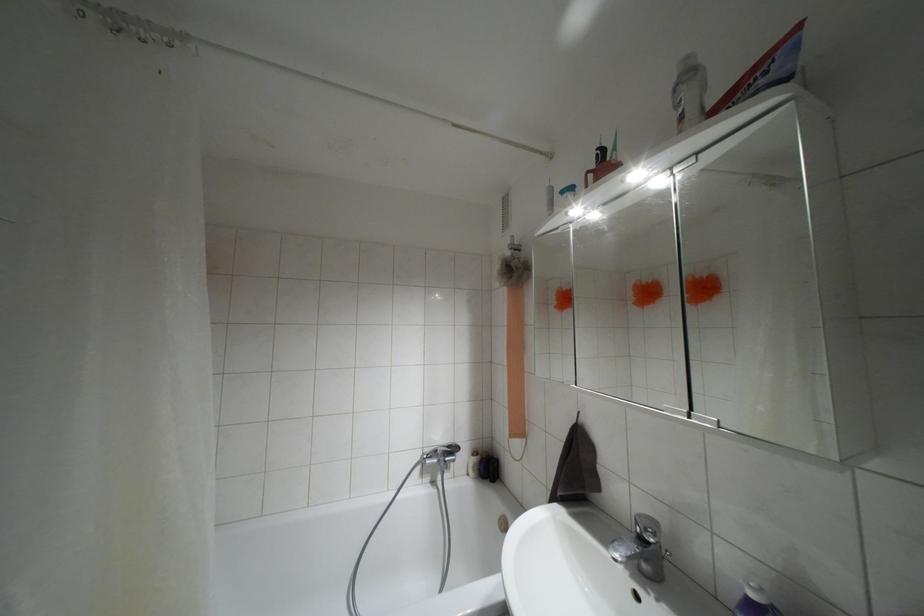
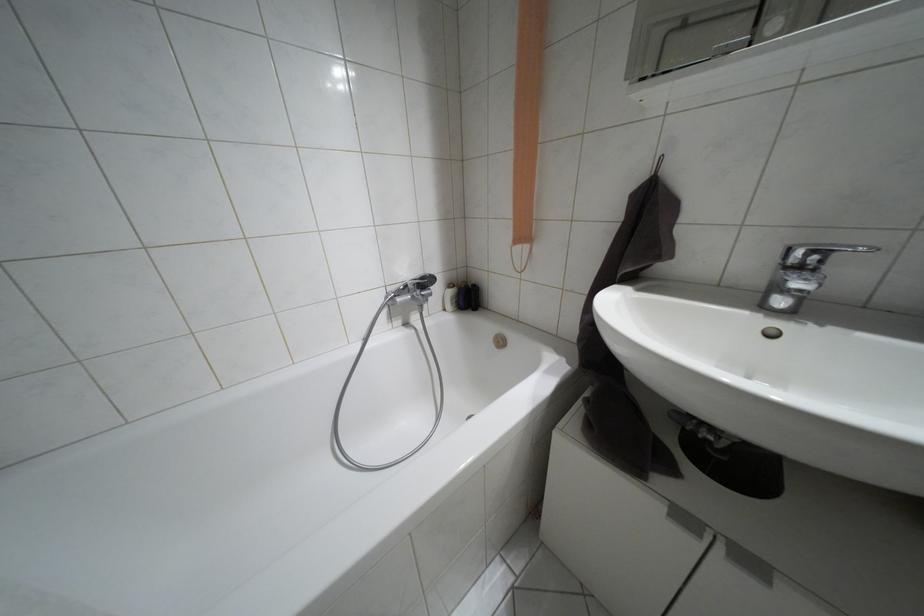
First-person continuous shooting, in which direction is the camera rotating?

The rotation direction of the camera is right-down.